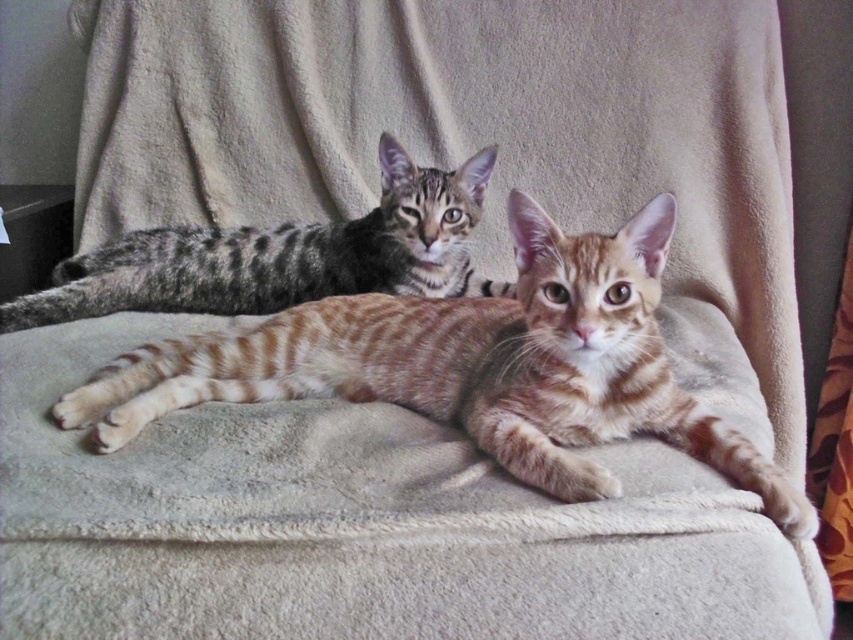
Based on the photo, you are a photographer trying to capture a clear photo of both cats. Since the golden tabby cat at center is closer to the viewer than the gray striped kitten at upper left, which cat should you focus on to ensure both are in sharp focus?

You should focus on the golden tabby cat at center because it is closer to the viewer. By focusing on the closer cat, the gray striped kitten at upper left will be in the depth of field and both will be in sharp focus.

You are a photographer trying to capture a closeup of the golden tabby cat at center. However, the gray striped kitten at upper left is blocking part of the view. Can you estimate if the kitten is smaller than the cat?

The golden tabby cat at center is larger in size than the gray striped kitten at upper left, so yes, the gray striped kitten at upper left is smaller and might be easier to maneuver around to get a clear shot of the golden tabby cat at center.